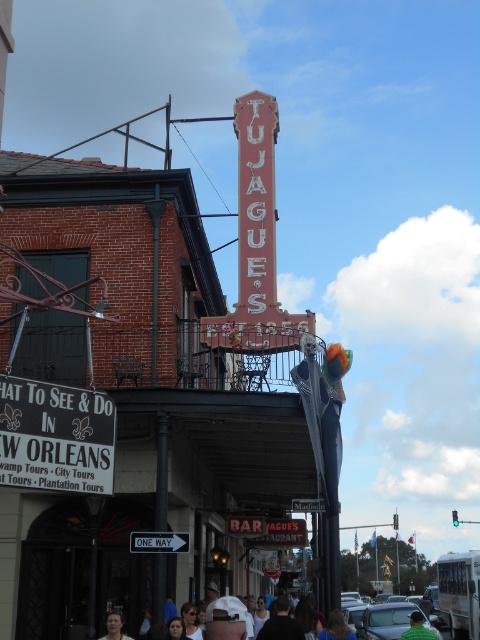
Question: Which point is closer to the camera?

Choices:
 (A) white plastic sign at center
 (B) green fabric shirt at lower center
 (C) matte black shirt at lower center

Answer: (A)

Question: Is matte black shirt at lower center thinner than green fabric shirt at lower center?

Choices:
 (A) no
 (B) yes

Answer: (A)

Question: Which object is farther from the camera taking this photo?

Choices:
 (A) smooth skin face at lower center
 (B) matte black shirt at lower center
 (C) white paper sign at lower left

Answer: (B)

Question: Is red painted metal sign at upper center positioned at the back of smooth skin face at lower center?

Choices:
 (A) yes
 (B) no

Answer: (B)

Question: Considering the real-world distances, which object is closest to the smooth skin face at lower center?

Choices:
 (A) white paper sign at lower left
 (B) white plastic sign at center

Answer: (B)

Question: Does red painted metal sign at upper center appear over matte black shirt at lower center?

Choices:
 (A) yes
 (B) no

Answer: (A)